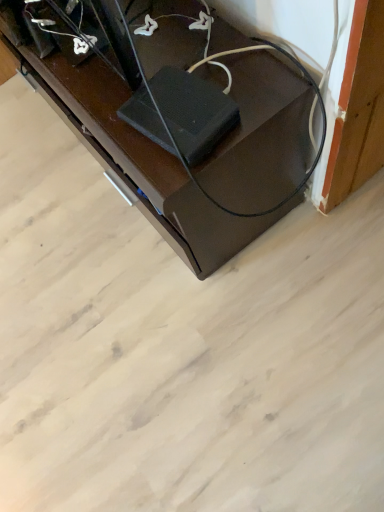
Identify the location of vacant space in front of black glossy speaker at lower right. This screenshot has width=384, height=512. (195, 342).